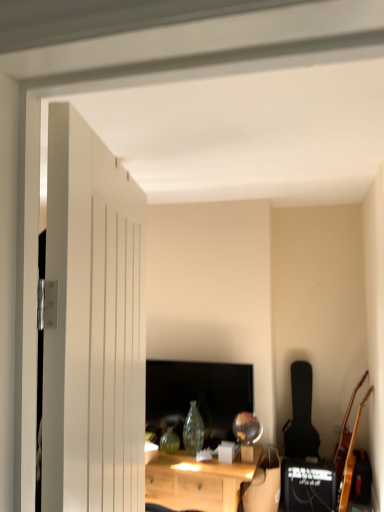
Question: Would you say black matte speaker at lower right is inside or outside light wood desk at center?

Choices:
 (A) inside
 (B) outside

Answer: (B)

Question: From the image's perspective, is black matte speaker at lower right positioned above or below light wood desk at center?

Choices:
 (A) below
 (B) above

Answer: (A)

Question: Which of these objects is positioned farthest from the black matte speaker at lower right?

Choices:
 (A) white wooden door at left
 (B) black matte guitar at right, the 1th guitar when ordered from back to front
 (C) matte black monitor at center
 (D) light wood desk at center
 (E) wooden acoustic guitar at right, arranged as the second guitar when viewed from the back

Answer: (A)

Question: Which object is positioned farthest from the white wooden door at left?

Choices:
 (A) matte black monitor at center
 (B) wooden acoustic guitar at right, the 1th guitar positioned from the right
 (C) black matte speaker at lower right
 (D) black matte guitar at right, the 1th guitar when ordered from back to front
 (E) light wood desk at center

Answer: (D)